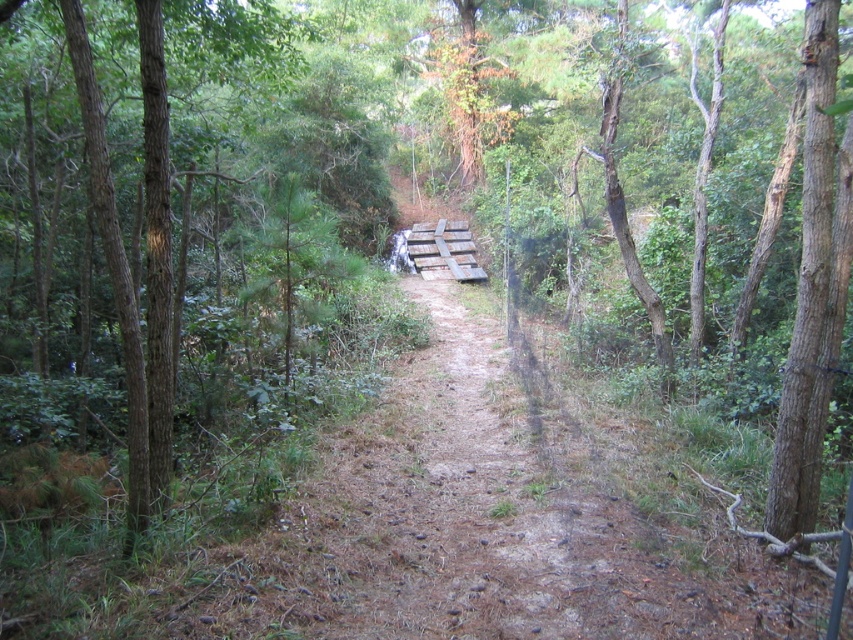
Consider the image. Can you confirm if brown textured tree at left is smaller than brown rough bark tree at right?

Yes, brown textured tree at left is smaller than brown rough bark tree at right.

Between point (51, 294) and point (850, 257), which one is positioned behind?

Point (51, 294)

Identify the location of brown textured tree at left. The height and width of the screenshot is (640, 853). (51, 236).